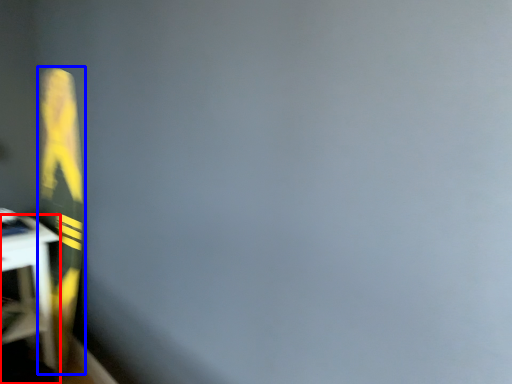
Question: Which object appears closest to the camera in this image, furniture (highlighted by a red box) or bulletin board (highlighted by a blue box)?

Choices:
 (A) furniture
 (B) bulletin board

Answer: (B)